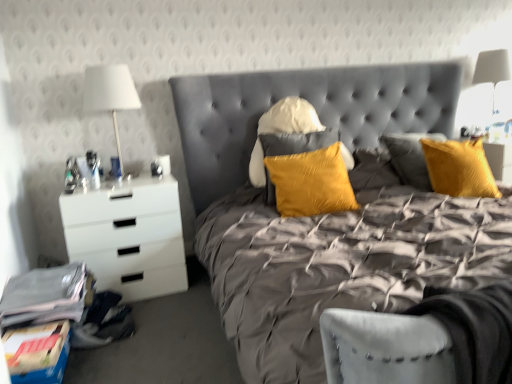
Measure the distance between point (135, 104) and camera.

Point (135, 104) is 2.49 meters away from camera.

What do you see at coordinates (322, 216) in the screenshot? The height and width of the screenshot is (384, 512). I see `velvet grey bed at center` at bounding box center [322, 216].

The image size is (512, 384). What do you see at coordinates (311, 182) in the screenshot?
I see `satin yellow pillow at center` at bounding box center [311, 182].

Identify the location of white glossy chest of drawers at left. This screenshot has width=512, height=384. pyautogui.click(x=128, y=236).

This screenshot has width=512, height=384. What are the coordinates of `white fabric lampshade at left, which is the 1th bedside lamp in left-to-right order` in the screenshot? It's located at (110, 94).

How different are the orientations of velvet grey bed at center and white glossy chest of drawers at left in degrees?

The angular difference between velvet grey bed at center and white glossy chest of drawers at left is 1.91 degrees.

From the image's perspective, between velvet grey bed at center and white glossy chest of drawers at left, who is located below?

From the image's view, white glossy chest of drawers at left is below.

Is velvet grey bed at center oriented away from white glossy chest of drawers at left?

No, white glossy chest of drawers at left is not at the back of velvet grey bed at center.

This screenshot has width=512, height=384. In order to click on chest of drawers behind the velvet grey bed at center in this screenshot , I will do `click(128, 236)`.

Is white fabric lampshade at upper right, positioned as the second bedside lamp in front-to-back order, facing towards satin yellow pillow at center?

No, white fabric lampshade at upper right, positioned as the second bedside lamp in front-to-back order, is not oriented towards satin yellow pillow at center.

Who is smaller, white fabric lampshade at upper right, which is the 2th bedside lamp from left to right, or satin yellow pillow at center?

white fabric lampshade at upper right, which is the 2th bedside lamp from left to right.

Measure the distance from white fabric lampshade at upper right, which is the 1th bedside lamp from back to front, to satin yellow pillow at center.

white fabric lampshade at upper right, which is the 1th bedside lamp from back to front, and satin yellow pillow at center are 6.48 feet apart.

Is white fabric lampshade at upper right, which is the 1th bedside lamp from back to front, far away from velvet grey bed at center?

Yes, white fabric lampshade at upper right, which is the 1th bedside lamp from back to front, and velvet grey bed at center are located far from each other.

Does white fabric lampshade at upper right, which is the 1th bedside lamp from back to front, have a smaller size compared to velvet grey bed at center?

Indeed, white fabric lampshade at upper right, which is the 1th bedside lamp from back to front, has a smaller size compared to velvet grey bed at center.

How many degrees apart are the facing directions of white fabric lampshade at upper right, the 1th bedside lamp positioned from the right, and velvet grey bed at center?

white fabric lampshade at upper right, the 1th bedside lamp positioned from the right, and velvet grey bed at center are facing 0.499 degrees away from each other.

Find the location of a particular element. bedside lamp that is the 2nd object located above the velvet grey bed at center (from the image's perspective) is located at coordinates (492, 69).

Is the position of white glossy chest of drawers at left more distant than that of white fabric lampshade at left, which is counted as the second bedside lamp, starting from the right?

→ No, white glossy chest of drawers at left is closer to the camera.

Find the location of `chest of drawers in front of the white fabric lampshade at left, which appears as the first bedside lamp when viewed from the front`. chest of drawers in front of the white fabric lampshade at left, which appears as the first bedside lamp when viewed from the front is located at coordinates (128, 236).

Is white glossy chest of drawers at left smaller than white fabric lampshade at left, which is the 1th bedside lamp in left-to-right order?

No, white glossy chest of drawers at left is not smaller than white fabric lampshade at left, which is the 1th bedside lamp in left-to-right order.

Which is in front, point (97, 248) or point (84, 81)?

Positioned in front is point (97, 248).

Based on the photo, is velvet grey bed at center at the back of white glossy chest of drawers at left?

No, white glossy chest of drawers at left is not facing away from velvet grey bed at center.

From the image's perspective, is white glossy chest of drawers at left on top of velvet grey bed at center?

No, from the image's perspective, white glossy chest of drawers at left is not above velvet grey bed at center.

From a real-world perspective, is white glossy chest of drawers at left beneath velvet grey bed at center?

Yes.

Would you consider velvet grey bed at center to be distant from white fabric lampshade at upper right, which is the 1th bedside lamp from back to front?

Indeed, velvet grey bed at center is not near white fabric lampshade at upper right, which is the 1th bedside lamp from back to front.

What's the angular difference between velvet grey bed at center and white fabric lampshade at upper right, positioned as the second bedside lamp in front-to-back order,'s facing directions?

velvet grey bed at center and white fabric lampshade at upper right, positioned as the second bedside lamp in front-to-back order, are facing 0.499 degrees away from each other.

Is velvet grey bed at center bigger or smaller than white fabric lampshade at upper right, which is the 1th bedside lamp from back to front?

In the image, velvet grey bed at center appears to be larger than white fabric lampshade at upper right, which is the 1th bedside lamp from back to front.

Considering the relative positions of velvet grey bed at center and white fabric lampshade at upper right, which is the 2th bedside lamp from left to right, in the image provided, is velvet grey bed at center in front of white fabric lampshade at upper right, which is the 2th bedside lamp from left to right,?

That is True.

Which bedside lamp is the 2nd one when counting from the back of the white glossy chest of drawers at left? Please provide its 2D coordinates.

[(492, 69)]

Can you tell me how much white fabric lampshade at upper right, positioned as the second bedside lamp in front-to-back order, and white glossy chest of drawers at left differ in facing direction?

The angular difference between white fabric lampshade at upper right, positioned as the second bedside lamp in front-to-back order, and white glossy chest of drawers at left is 2.41 degrees.

Between white fabric lampshade at upper right, positioned as the second bedside lamp in front-to-back order, and white glossy chest of drawers at left, which one appears on the right side from the viewer's perspective?

white fabric lampshade at upper right, positioned as the second bedside lamp in front-to-back order, is more to the right.

Is point (479, 65) positioned before point (136, 287)?

No, (479, 65) is behind (136, 287).

At what (x,y) coordinates should I click in order to perform the action: click on chest of drawers on the left of velvet grey bed at center. Please return your answer as a coordinate pair (x, y). The width and height of the screenshot is (512, 384). Looking at the image, I should click on (128, 236).

You are a GUI agent. You are given a task and a screenshot of the screen. Output one action in this format:
    pyautogui.click(x=<x>, y=<y>)
    Task: Click on the pillow that is under the white fabric lampshade at upper right, the 1th bedside lamp positioned from the right (from a real-world perspective)
    This screenshot has width=512, height=384.
    Given the screenshot: What is the action you would take?
    pyautogui.click(x=311, y=182)

From the image, which object appears to be farther from satin yellow pillow at center, velvet grey bed at center or white fabric lampshade at left, which is the 1th bedside lamp in left-to-right order?

white fabric lampshade at left, which is the 1th bedside lamp in left-to-right order, is further to satin yellow pillow at center.

Estimate the real-world distances between objects in this image. Which object is further from velvet grey bed at center, white glossy chest of drawers at left or white fabric lampshade at upper right, the 1th bedside lamp positioned from the right?

white fabric lampshade at upper right, the 1th bedside lamp positioned from the right.

Looking at the image, which one is located closer to velvet grey bed at center, white glossy chest of drawers at left or satin yellow pillow at center?

The object closer to velvet grey bed at center is satin yellow pillow at center.

Looking at this image, estimate the real-world distances between objects in this image. Which object is further from white glossy chest of drawers at left, white fabric lampshade at upper right, which is the 2th bedside lamp from left to right, or satin yellow pillow at center?

white fabric lampshade at upper right, which is the 2th bedside lamp from left to right.

Based on their spatial positions, is white glossy chest of drawers at left or white fabric lampshade at left, the second bedside lamp viewed from the back, closer to white fabric lampshade at upper right, which is the 1th bedside lamp from back to front?

Among the two, white fabric lampshade at left, the second bedside lamp viewed from the back, is located nearer to white fabric lampshade at upper right, which is the 1th bedside lamp from back to front.

Based on their spatial positions, is satin yellow pillow at center or white fabric lampshade at left, which is counted as the second bedside lamp, starting from the right, closer to white glossy chest of drawers at left?

white fabric lampshade at left, which is counted as the second bedside lamp, starting from the right, is positioned closer to the anchor white glossy chest of drawers at left.

From the image, which object appears to be nearer to velvet grey bed at center, white fabric lampshade at upper right, the 1th bedside lamp positioned from the right, or satin yellow pillow at center?

The object closer to velvet grey bed at center is satin yellow pillow at center.

From the image, which object appears to be farther from velvet grey bed at center, satin yellow pillow at center or white glossy chest of drawers at left?

Based on the image, white glossy chest of drawers at left appears to be further to velvet grey bed at center.

Where is `pillow between white glossy chest of drawers at left and white fabric lampshade at upper right, which is the 1th bedside lamp from back to front, in the horizontal direction`? The image size is (512, 384). pillow between white glossy chest of drawers at left and white fabric lampshade at upper right, which is the 1th bedside lamp from back to front, in the horizontal direction is located at coordinates (311, 182).

Where is `pillow between velvet grey bed at center and white fabric lampshade at upper right, positioned as the second bedside lamp in front-to-back order, in the front-back direction`? The width and height of the screenshot is (512, 384). pillow between velvet grey bed at center and white fabric lampshade at upper right, positioned as the second bedside lamp in front-to-back order, in the front-back direction is located at coordinates (311, 182).

The image size is (512, 384). In order to click on bed between white fabric lampshade at left, which is the 1th bedside lamp in left-to-right order, and white fabric lampshade at upper right, positioned as the second bedside lamp in front-to-back order in this screenshot , I will do `click(322, 216)`.

Locate an element on the screen. This screenshot has height=384, width=512. bed between white glossy chest of drawers at left and white fabric lampshade at upper right, the 1th bedside lamp positioned from the right, in the horizontal direction is located at coordinates (322, 216).